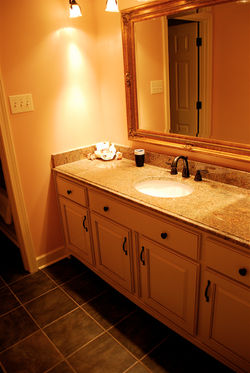
Where is `wall`? The height and width of the screenshot is (373, 250). wall is located at coordinates (46, 75), (117, 96), (238, 100).